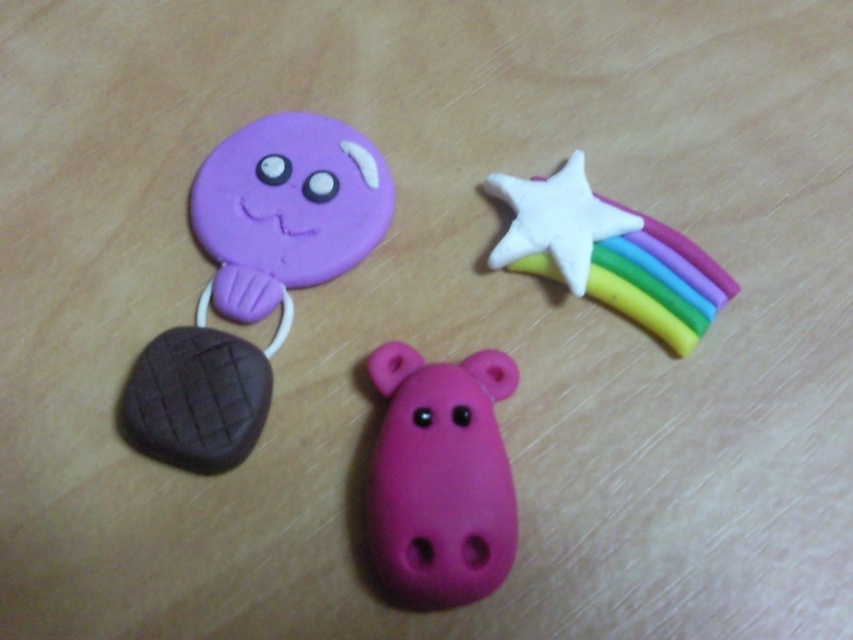
Who is positioned more to the right, matte purple cookie at upper left or pastel rainbow star at upper right?

From the viewer's perspective, pastel rainbow star at upper right appears more on the right side.

At what (x,y) coordinates should I click in order to perform the action: click on matte purple cookie at upper left. Please return your answer as a coordinate pair (x, y). Looking at the image, I should click on (286, 209).

Based on the photo, who is more forward, (241, 241) or (508, 243)?

Positioned in front is point (508, 243).

The image size is (853, 640). What are the coordinates of `matte purple cookie at upper left` in the screenshot? It's located at click(286, 209).

What do you see at coordinates (608, 253) in the screenshot? I see `pastel rainbow star at upper right` at bounding box center [608, 253].

Is pastel rainbow star at upper right taller than white matte star at upper right?

Yes, pastel rainbow star at upper right is taller than white matte star at upper right.

Where is `pastel rainbow star at upper right`? pastel rainbow star at upper right is located at coordinates (608, 253).

Based on the photo, who is shorter, matte purple cookie at upper left or pink matte hippo at center?

Standing shorter between the two is pink matte hippo at center.

Between point (345, 198) and point (436, 584), which one is positioned in front?

Point (436, 584)

Find the location of `matte purple cookie at upper left`. matte purple cookie at upper left is located at coordinates (286, 209).

You are a GUI agent. You are given a task and a screenshot of the screen. Output one action in this format:
    pyautogui.click(x=<x>, y=<y>)
    Task: Click on the matte purple cookie at upper left
    
    Given the screenshot: What is the action you would take?
    pyautogui.click(x=286, y=209)